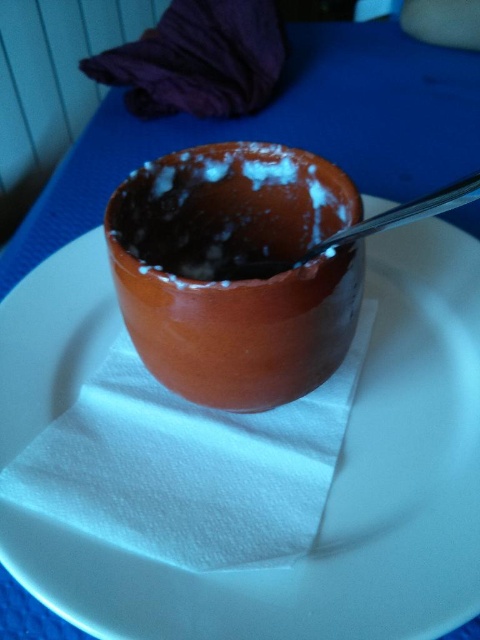
Question: Which object is closer to the camera taking this photo?

Choices:
 (A) white paper napkin at center
 (B) brown matte bowl at center

Answer: (A)

Question: Which point is farther from the camera taking this photo?

Choices:
 (A) (247, 273)
 (B) (232, 176)
 (C) (172, 572)

Answer: (A)

Question: Where is brown matte bowl at center located in relation to purple fabric at upper left in the image?

Choices:
 (A) left
 (B) right

Answer: (B)

Question: Is brown matte bowl at center in front of purple fabric at upper left?

Choices:
 (A) no
 (B) yes

Answer: (B)

Question: Which object is the closest to the white paper napkin at center?

Choices:
 (A) satin silver spoon at upper center
 (B) purple fabric at upper left

Answer: (A)

Question: Is purple fabric at upper left positioned at the back of satin silver spoon at upper center?

Choices:
 (A) yes
 (B) no

Answer: (A)